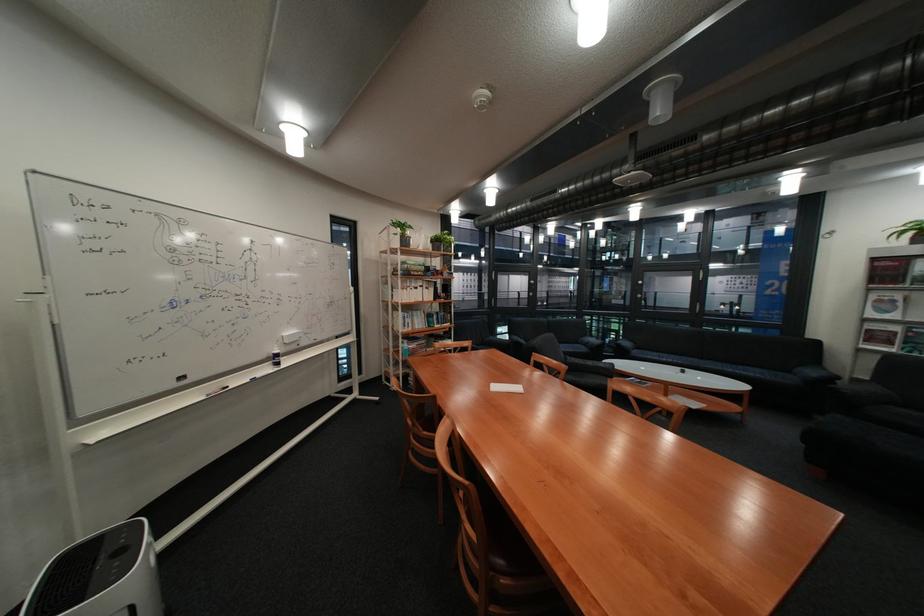
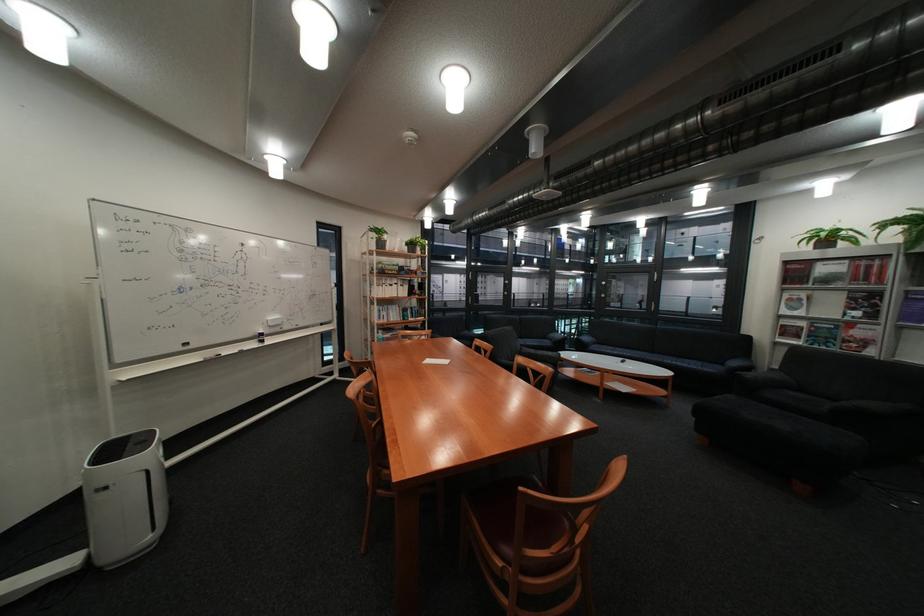
Where in the second image is the point corresponding to point (446, 241) from the first image?

(421, 245)